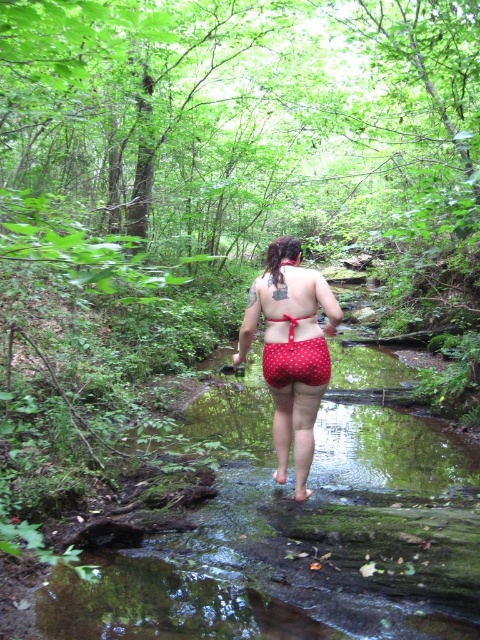
You are a hiker who has just come across this forest scene. You notice two red items at the center of the image. Which one is taller between the red polka dot shorts at center and the red dotted fabric at center?

The red polka dot shorts at center is taller than the red dotted fabric at center according to the description.

You are a hiker navigating through the forest depicted in the image. You come across two points marked on the ground. The first point is at coordinates point (314, 339) and the second is at point (292, 260). Which point is closer to you as you stand at the starting position?

Point (314, 339) is closer to the viewer than point (292, 260), so the first point is closer to you.